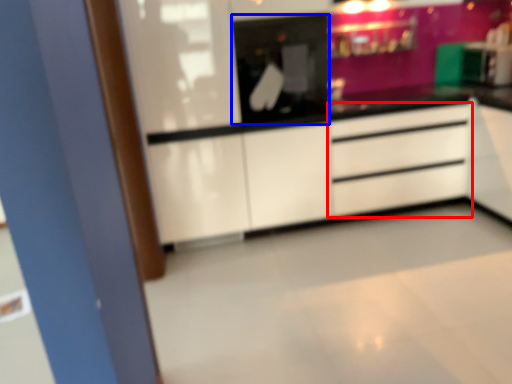
Question: Which object is further to the camera taking this photo, chest of drawers (highlighted by a red box) or appliance (highlighted by a blue box)?

Choices:
 (A) chest of drawers
 (B) appliance

Answer: (A)